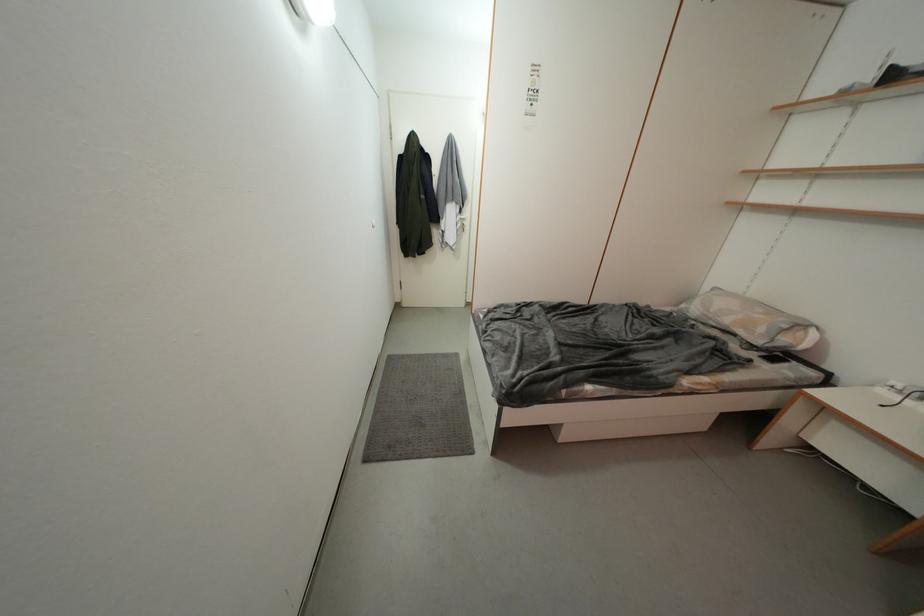
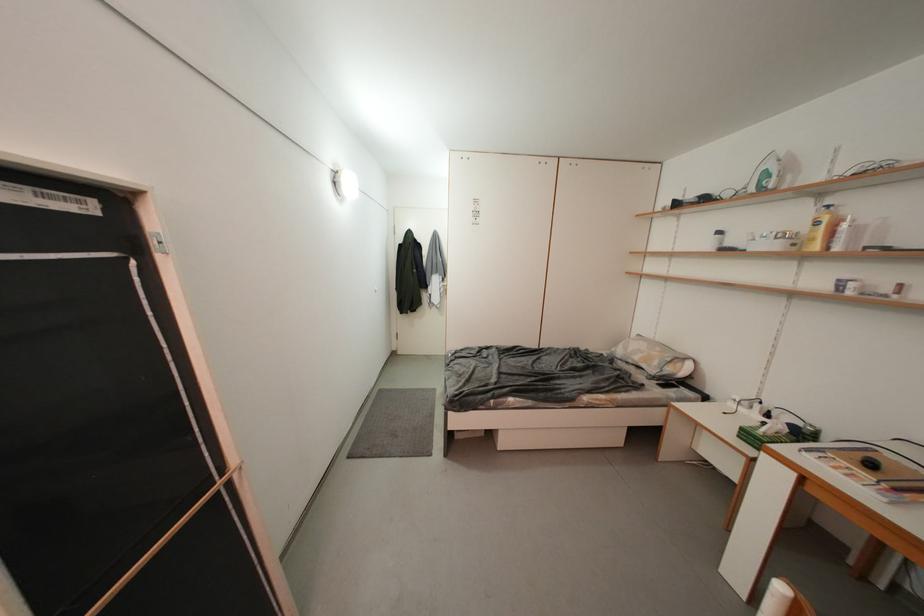
Which direction would the cameraman need to move to produce the second image?

The movement direction of the cameraman is right, backward.